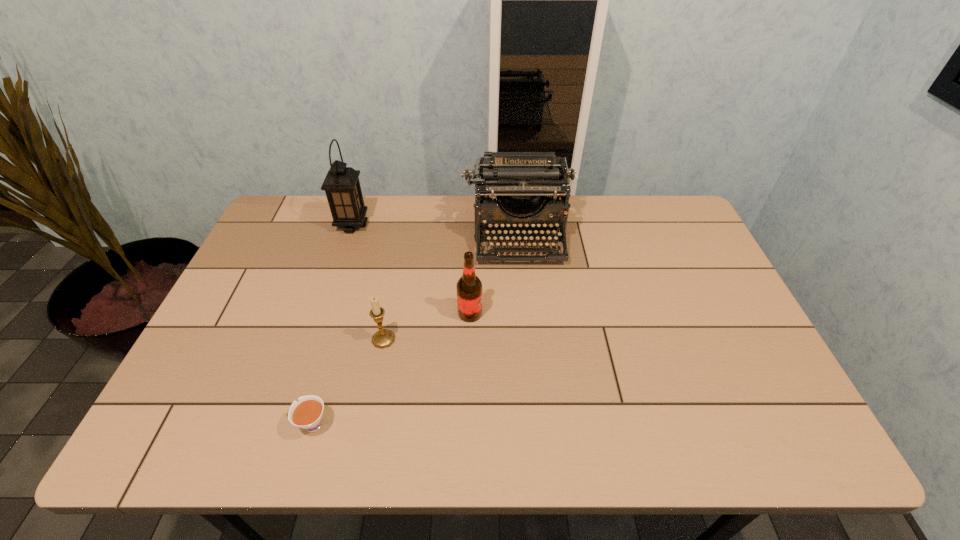
You are a GUI agent. You are given a task and a screenshot of the screen. Output one action in this format:
    pyautogui.click(x=<x>, y=<y>)
    Task: Click on the free point located on the left of the fourth farthest object
    
    Given the screenshot: What is the action you would take?
    pyautogui.click(x=253, y=339)

At what (x,y) coordinates should I click in order to perform the action: click on free space located 0.210m on the side of the shortest object with the handle. Please return your answer as a coordinate pair (x, y). Image resolution: width=960 pixels, height=540 pixels. Looking at the image, I should click on (198, 424).

Where is `vacant region located on the side of the shortest object with the handle`? The width and height of the screenshot is (960, 540). vacant region located on the side of the shortest object with the handle is located at coordinates (265, 424).

Identify the location of vacant position located 0.270m on the side of the shortest object with the handle. This screenshot has height=540, width=960. (171, 424).

The width and height of the screenshot is (960, 540). I want to click on lantern positioned at the far edge, so click(342, 187).

This screenshot has width=960, height=540. Identify the location of typewriter that is at the far edge. (515, 183).

Find the location of a particular element. This screenshot has height=540, width=960. object present at the near edge is located at coordinates (307, 413).

This screenshot has width=960, height=540. Identify the location of free space at the far edge. (625, 207).

Find the location of a particular element. The height and width of the screenshot is (540, 960). vacant area at the near edge of the desktop is located at coordinates tap(250, 421).

Where is `vacant space at the left edge of the desktop`? The width and height of the screenshot is (960, 540). vacant space at the left edge of the desktop is located at coordinates (248, 340).